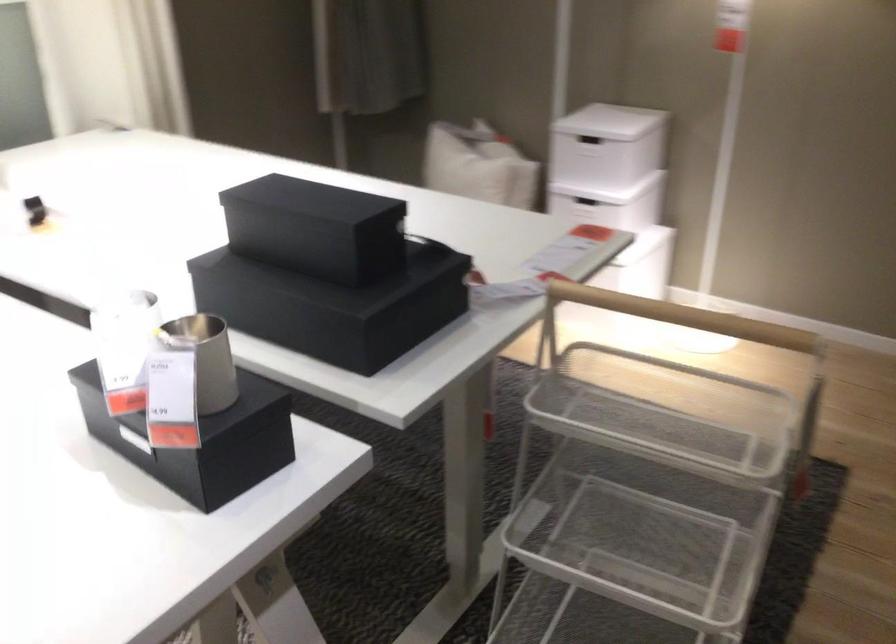
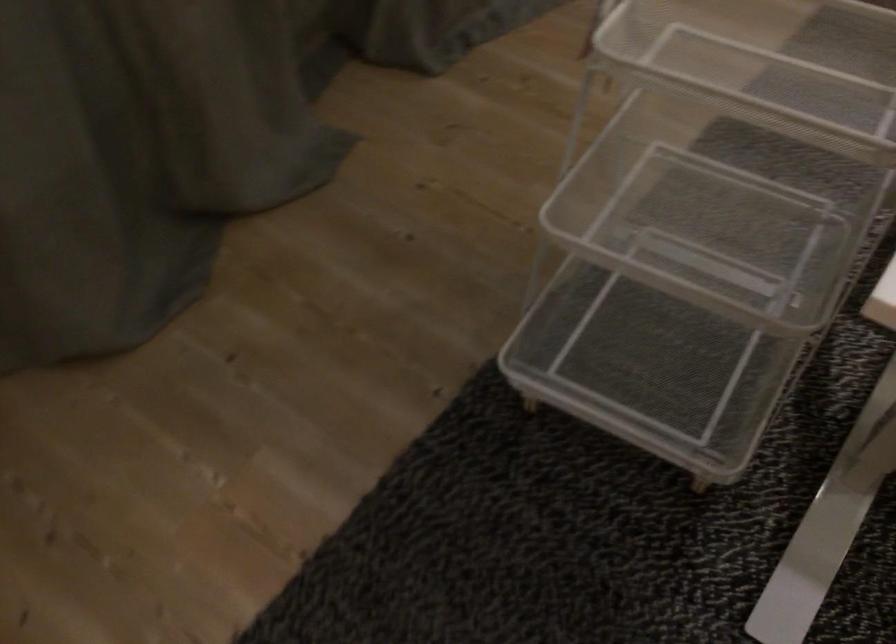
Where in the second image is the point corresponding to (629,449) from the first image?

(806, 69)